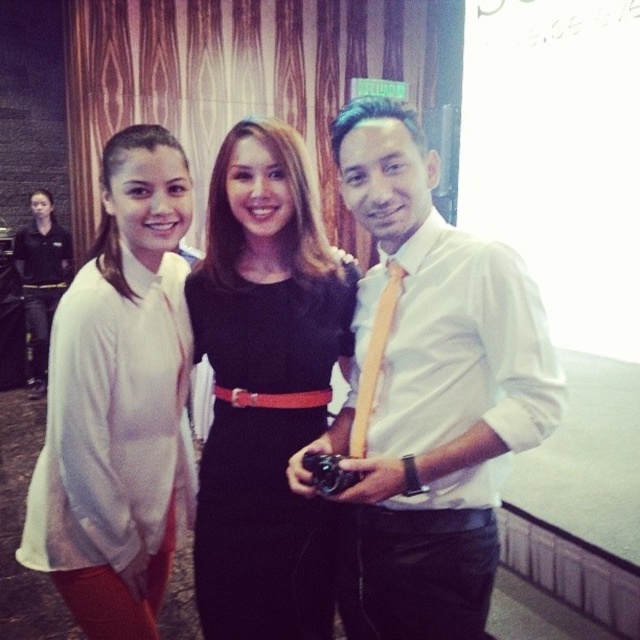
Consider the image. Is matte white blouse at left below yellow satin tie at center?

Yes, matte white blouse at left is below yellow satin tie at center.

Which is below, matte white blouse at left or yellow satin tie at center?

matte white blouse at left is lower down.

Is point (440, 397) farther from camera compared to point (385, 305)?

That is False.

Where is `matte white blouse at left`? Image resolution: width=640 pixels, height=640 pixels. matte white blouse at left is located at coordinates (396, 428).

Between point (225, 561) and point (388, 278), which one is positioned behind?

The point (225, 561) is more distant.

Who is higher up, black satin dress at center or yellow satin tie at center?

yellow satin tie at center is above.

The height and width of the screenshot is (640, 640). What do you see at coordinates (266, 452) in the screenshot?
I see `black satin dress at center` at bounding box center [266, 452].

You are a GUI agent. You are given a task and a screenshot of the screen. Output one action in this format:
    pyautogui.click(x=<x>, y=<y>)
    Task: Click on the black satin dress at center
    The height and width of the screenshot is (640, 640).
    Given the screenshot: What is the action you would take?
    pyautogui.click(x=266, y=452)

Who is higher up, black satin dress at center or black uniform at left?

black uniform at left is higher up.

Who is taller, black satin dress at center or black uniform at left?

Standing taller between the two is black uniform at left.

The image size is (640, 640). I want to click on black satin dress at center, so click(266, 452).